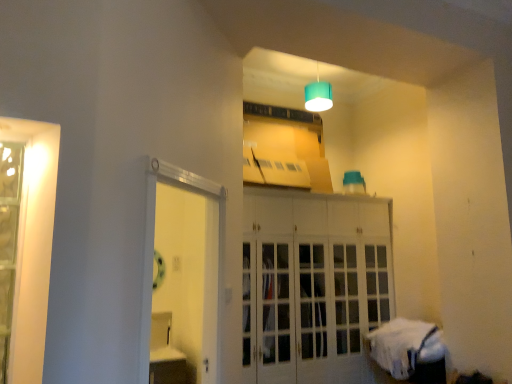
This screenshot has height=384, width=512. I want to click on teal fabric lampshade at upper center, so click(318, 95).

What do you see at coordinates (405, 346) in the screenshot? This screenshot has width=512, height=384. I see `white fabric bed at lower right` at bounding box center [405, 346].

The width and height of the screenshot is (512, 384). What do you see at coordinates (314, 284) in the screenshot?
I see `white glass cabinet at center` at bounding box center [314, 284].

Measure the distance between point [14,207] and camera.

The distance of point [14,207] from camera is 5.44 feet.

At what (x,y) coordinates should I click in order to perform the action: click on white glossy door at center. Please return your answer as a coordinate pair (x, y). Image resolution: width=512 pixels, height=384 pixels. Looking at the image, I should click on (188, 275).

Would you say teal fabric lampshade at upper center is inside or outside white fabric bed at lower right?

teal fabric lampshade at upper center is located beyond the bounds of white fabric bed at lower right.

From the image's perspective, does teal fabric lampshade at upper center appear lower than white fabric bed at lower right?

No, from the image's perspective, teal fabric lampshade at upper center is not beneath white fabric bed at lower right.

Considering the sizes of objects teal fabric lampshade at upper center and white fabric bed at lower right in the image provided, who is thinner, teal fabric lampshade at upper center or white fabric bed at lower right?

With smaller width is teal fabric lampshade at upper center.

Between teal fabric lampshade at upper center and white glossy door at center, which one appears on the left side from the viewer's perspective?

white glossy door at center is more to the left.

Does teal fabric lampshade at upper center contain white glossy door at center?

That's incorrect, white glossy door at center is not inside teal fabric lampshade at upper center.

Which of these two, teal fabric lampshade at upper center or white glossy door at center, is smaller?

teal fabric lampshade at upper center is smaller.

From a real-world perspective, is teal fabric lampshade at upper center physically below white glossy door at center?

No.

How distant is white glass cabinet at center from clear glass door at left?

white glass cabinet at center and clear glass door at left are 2.56 meters apart from each other.

Considering the relative positions of white glass cabinet at center and clear glass door at left in the image provided, is white glass cabinet at center to the left or to the right of clear glass door at left?

In the image, white glass cabinet at center appears on the right side of clear glass door at left.

Which object is more forward, white glass cabinet at center or clear glass door at left?

Positioned in front is clear glass door at left.

Which of these two, white glass cabinet at center or clear glass door at left, is thinner?

Thinner between the two is clear glass door at left.

Does clear glass door at left turn towards teal fabric lampshade at upper center?

No, clear glass door at left is not oriented towards teal fabric lampshade at upper center.

Is clear glass door at left closer to the viewer compared to teal fabric lampshade at upper center?

Yes.

Is clear glass door at left taller or shorter than teal fabric lampshade at upper center?

Clearly, clear glass door at left is taller compared to teal fabric lampshade at upper center.

Where is `window in front of the white glossy door at center`? This screenshot has height=384, width=512. window in front of the white glossy door at center is located at coordinates (25, 243).

Measure the distance between white glossy door at center and clear glass door at left.

white glossy door at center and clear glass door at left are 2.06 meters apart.

Based on the photo, is white glossy door at center smaller than clear glass door at left?

No.

Which is less distant, (247, 218) or (437, 330)?

Positioned in front is point (437, 330).

Is white glass cabinet at center turned away from white fabric bed at lower right?

No, white glass cabinet at center is not facing away from white fabric bed at lower right.

From the picture: Does white glass cabinet at center have a lesser height compared to white fabric bed at lower right?

In fact, white glass cabinet at center may be taller than white fabric bed at lower right.

There is a white fabric bed at lower right. Find the location of `cabinetry above it (from a real-world perspective)`. cabinetry above it (from a real-world perspective) is located at coordinates (314, 284).

Does point (418, 321) lie in front of point (253, 207)?

No, it is behind (253, 207).

Can you confirm if white fabric bed at lower right is smaller than white glass cabinet at center?

Indeed, white fabric bed at lower right has a smaller size compared to white glass cabinet at center.

Is white fabric bed at lower right taller than white glass cabinet at center?

In fact, white fabric bed at lower right may be shorter than white glass cabinet at center.

Considering the positions of objects white fabric bed at lower right and white glass cabinet at center in the image provided, who is more to the right, white fabric bed at lower right or white glass cabinet at center?

Positioned to the right is white fabric bed at lower right.

You are a GUI agent. You are given a task and a screenshot of the screen. Output one action in this format:
    pyautogui.click(x=<x>, y=<y>)
    Task: Click on the lamp lying above the white fabric bed at lower right (from the image's perspective)
    Image resolution: width=512 pixels, height=384 pixels.
    Given the screenshot: What is the action you would take?
    pyautogui.click(x=318, y=95)

Locate an element on the screen. The image size is (512, 384). door on the left of teal fabric lampshade at upper center is located at coordinates pos(188,275).

Estimate the real-world distances between objects in this image. Which object is closer to white glossy door at center, clear glass door at left or white fabric bed at lower right?

white fabric bed at lower right is positioned closer to the anchor white glossy door at center.

When comparing their distances from white glass cabinet at center, does teal fabric lampshade at upper center or clear glass door at left seem closer?

The object closer to white glass cabinet at center is teal fabric lampshade at upper center.

When comparing their distances from clear glass door at left, does white glass cabinet at center or white fabric bed at lower right seem further?

white fabric bed at lower right.

From the image, which object appears to be farther from white glossy door at center, white glass cabinet at center or clear glass door at left?

clear glass door at left.

Considering their positions, is white fabric bed at lower right positioned further to white glossy door at center than clear glass door at left?

Based on the image, clear glass door at left appears to be further to white glossy door at center.

From the image, which object appears to be nearer to teal fabric lampshade at upper center, clear glass door at left or white glossy door at center?

white glossy door at center is positioned closer to the anchor teal fabric lampshade at upper center.

Looking at the image, which one is located closer to white fabric bed at lower right, clear glass door at left or white glass cabinet at center?

white glass cabinet at center is positioned closer to the anchor white fabric bed at lower right.

Considering their positions, is white glossy door at center positioned closer to white fabric bed at lower right than clear glass door at left?

Based on the image, white glossy door at center appears to be nearer to white fabric bed at lower right.

Identify the location of door between clear glass door at left and teal fabric lampshade at upper center from front to back. The image size is (512, 384). (188, 275).

What are the coordinates of `bed between clear glass door at left and teal fabric lampshade at upper center from front to back` in the screenshot? It's located at (405, 346).

Find the location of a particular element. cabinetry between clear glass door at left and teal fabric lampshade at upper center in the front-back direction is located at coordinates (314, 284).

What are the coordinates of `cabinetry between white glossy door at center and teal fabric lampshade at upper center from front to back` in the screenshot? It's located at (314, 284).